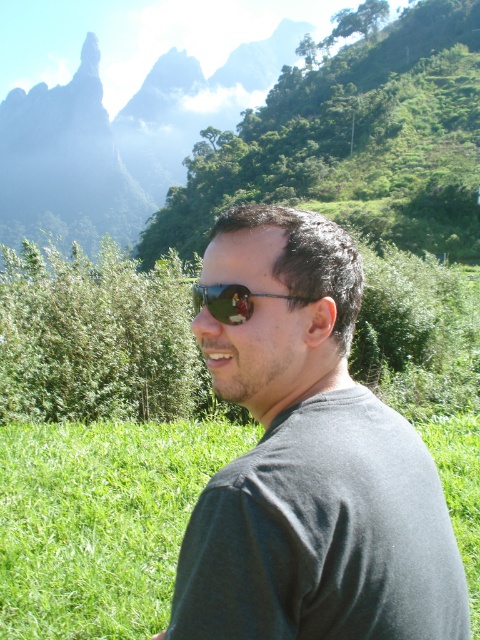
Which is in front, point (225, 516) or point (16, 426)?

Point (225, 516)

Between dark gray t-shirt at center and green grassy at center, which one appears on the left side from the viewer's perspective?

green grassy at center is more to the left.

The width and height of the screenshot is (480, 640). What are the coordinates of `dark gray t-shirt at center` in the screenshot? It's located at (310, 461).

Where is `dark gray t-shirt at center`? The width and height of the screenshot is (480, 640). dark gray t-shirt at center is located at coordinates (310, 461).

This screenshot has width=480, height=640. I want to click on dark gray t-shirt at center, so click(x=310, y=461).

Looking at this image, measure the distance between dark gray t-shirt at center and sunglasses at center.

dark gray t-shirt at center is 7.64 feet from sunglasses at center.

I want to click on dark gray t-shirt at center, so click(310, 461).

Where is `dark gray t-shirt at center`? dark gray t-shirt at center is located at coordinates (310, 461).

Between point (477, 435) and point (220, 308), which one is positioned in front?

Point (220, 308) is more forward.

This screenshot has width=480, height=640. What do you see at coordinates (99, 522) in the screenshot?
I see `green grassy at center` at bounding box center [99, 522].

Which is in front, point (462, 445) or point (225, 300)?

Point (225, 300)

Where is `green grassy at center`? Image resolution: width=480 pixels, height=640 pixels. green grassy at center is located at coordinates (99, 522).